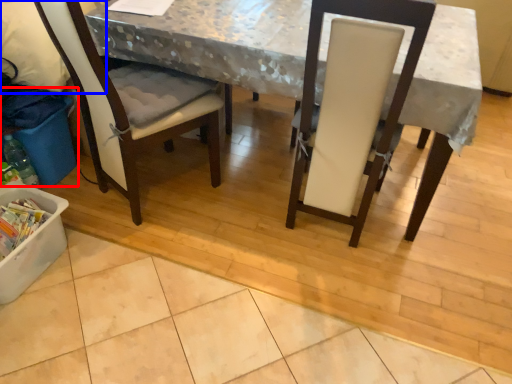
Question: Which point is closer to the camera, recycling bin (highlighted by a red box) or leftover (highlighted by a blue box)?

Choices:
 (A) recycling bin
 (B) leftover

Answer: (B)